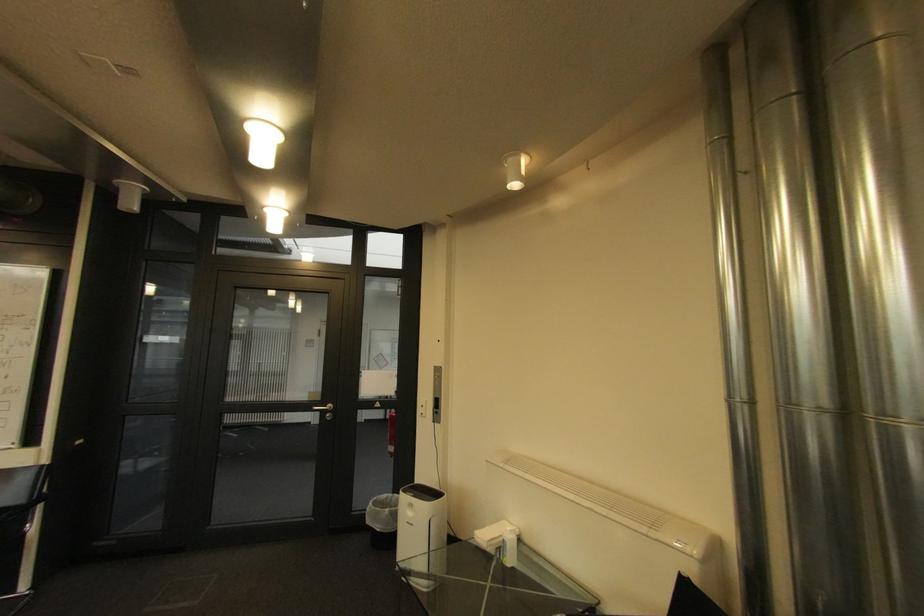
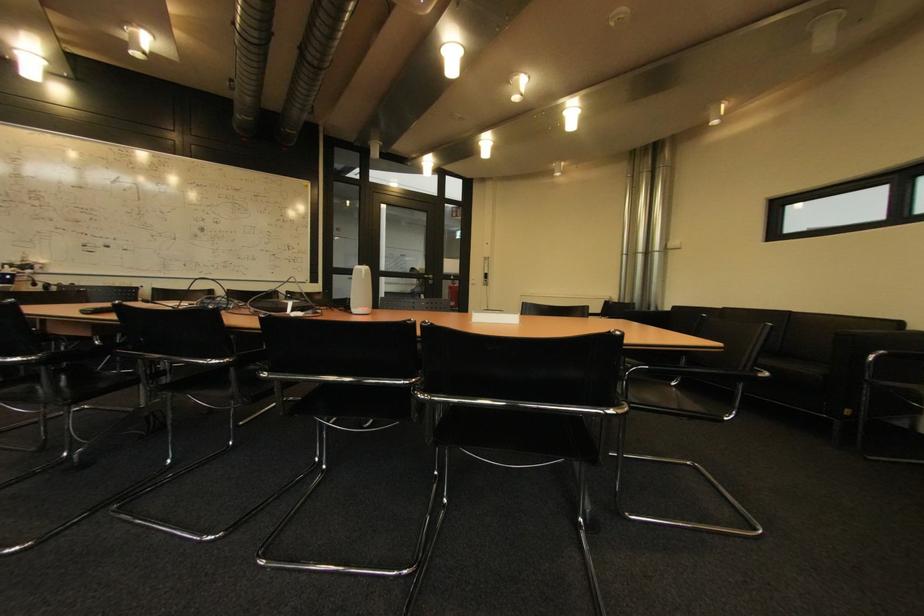
Where in the second image is the point corresponding to (378,406) from the first image?

(456, 278)